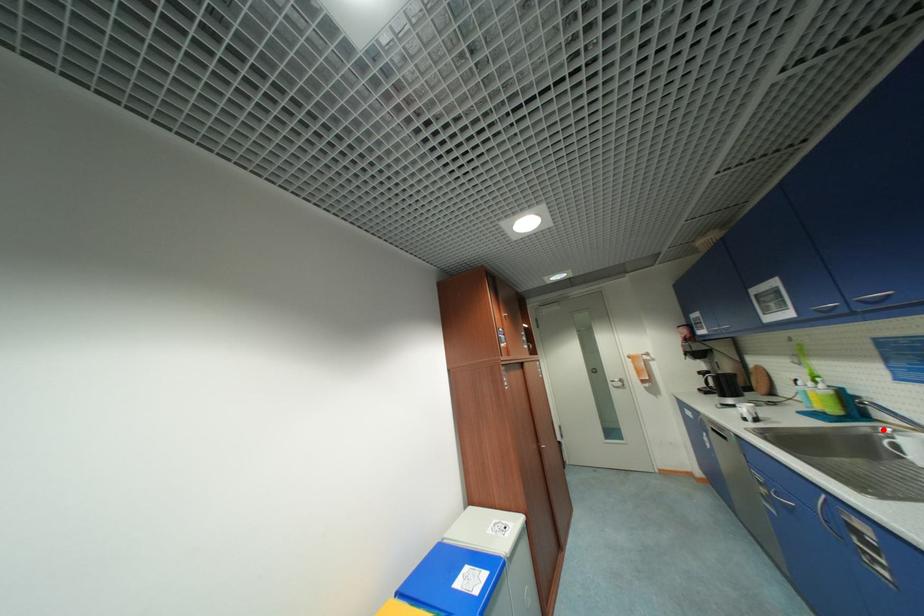
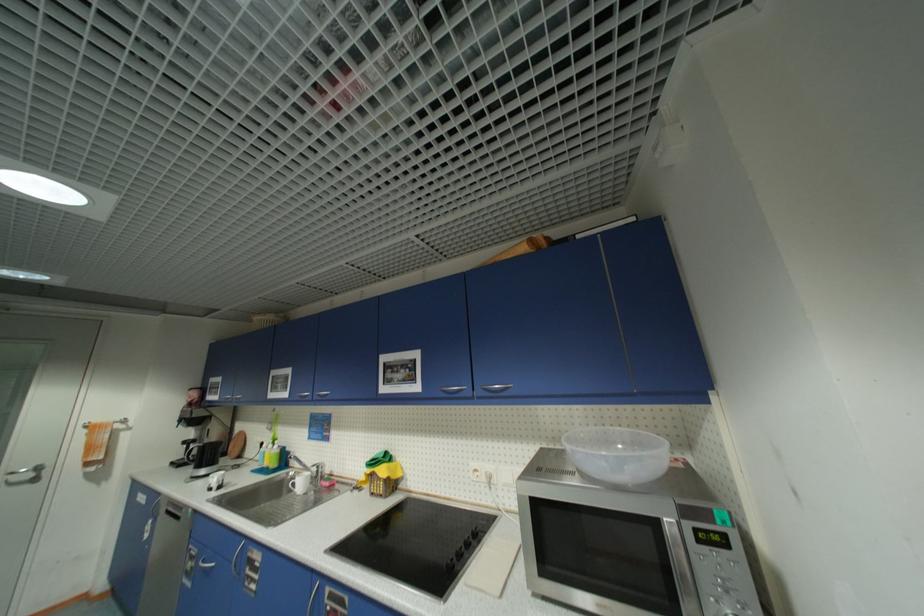
Question: I am providing you with two images of the same scene from different viewpoints. A red point is marked on the first image. Is the red point's position out of view in image 2?

Choices:
 (A) Yes
 (B) No

Answer: (B)